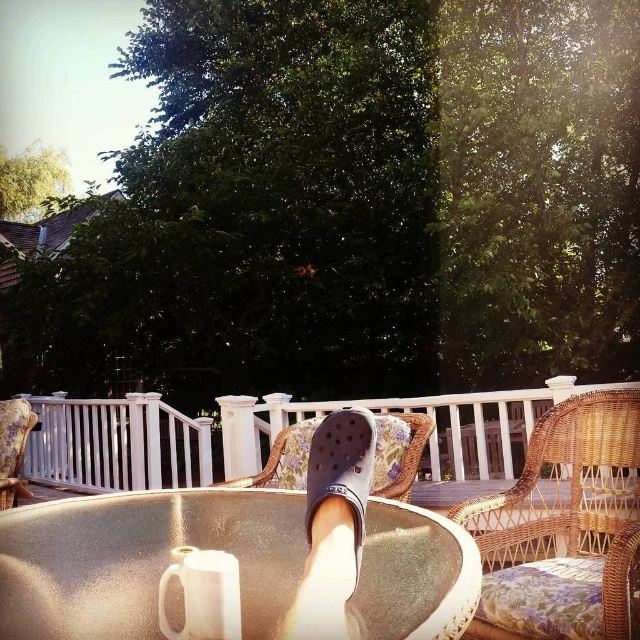
Can you confirm if clear acrylic jacuzzi at center is thinner than woven rattan armchair at center?

Indeed, clear acrylic jacuzzi at center has a lesser width compared to woven rattan armchair at center.

Does clear acrylic jacuzzi at center have a larger size compared to woven rattan armchair at center?

No, clear acrylic jacuzzi at center is not bigger than woven rattan armchair at center.

The image size is (640, 640). What do you see at coordinates (141, 560) in the screenshot? I see `clear acrylic jacuzzi at center` at bounding box center [141, 560].

Locate an element on the screen. This screenshot has height=640, width=640. clear acrylic jacuzzi at center is located at coordinates (141, 560).

How far apart are woven rattan armchair at center and gray rubber sandal at center?

woven rattan armchair at center is 5.23 feet away from gray rubber sandal at center.

Based on the photo, is woven rattan armchair at center to the right of gray rubber sandal at center from the viewer's perspective?

Yes, woven rattan armchair at center is to the right of gray rubber sandal at center.

In order to click on woven rattan armchair at center in this screenshot , I will do coord(564,529).

Is woven rattan armchair at center above woven wicker chair at center?

Yes, woven rattan armchair at center is above woven wicker chair at center.

From the picture: Who is more distant from viewer, (524, 515) or (476, 467)?

The point (476, 467) is behind.

I want to click on woven rattan armchair at center, so click(x=564, y=529).